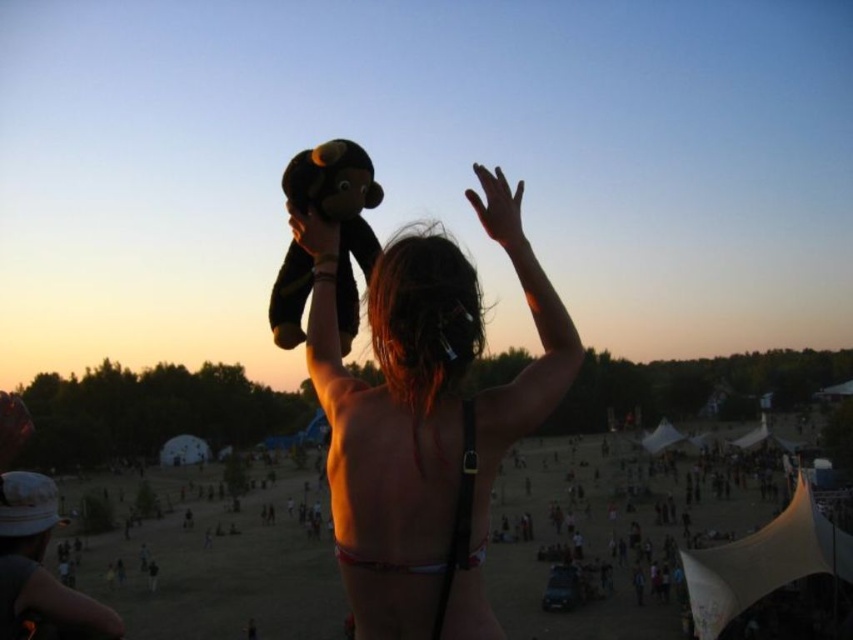
You are standing at the point marked as point (498,412) in the image. You want to take a photo of the sunset. The camera you are using has a focal length of 35mm. What is the minimum distance you need to move forward or backward to ensure the sunset fills the frame completely?

The distance of point (498,412) from viewer is 26.50 meters. To fill the frame with the sunset, you need to adjust your position so that the focal length and distance create an appropriate angle of view. However, since the sunset is a distant horizon, moving closer or farther won t significantly change its apparent size. Thus, it s not possible to fill the frame by moving alone with a 35mm lens.

You are a photographer trying to capture the perfect shot of the soft plush monkey at upper center and the white matte bikini top at upper center. Since you want to highlight both items equally, does the size difference between them pose a challenge?

The soft plush monkey at upper center is bigger than the white matte bikini top at upper center, so the size difference may make it challenging to highlight both items equally in the photograph.

You are a photographer trying to capture the perfect shot of the matte black plush monkey at upper center and the white matte bikini top at upper center. Based on their sizes in the image, which object should you focus on to ensure it fills the frame more effectively?

The matte black plush monkey at upper center is larger in size compared to the white matte bikini top at upper center, so focusing on the matte black plush monkey at upper center would fill the frame more effectively.